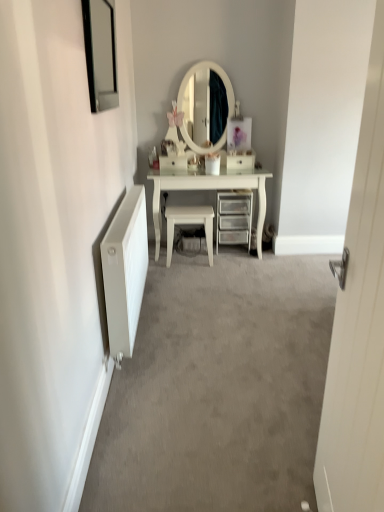
Identify the location of vacant region above white radiator at left (from a real-world perspective). The image size is (384, 512). (223, 349).